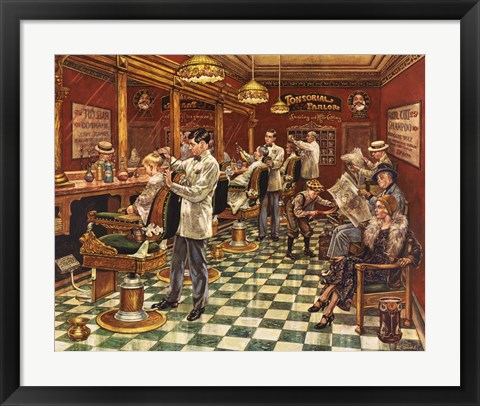
Locate an element on the screen. chairs is located at coordinates (137, 250), (235, 209), (296, 169), (382, 299).